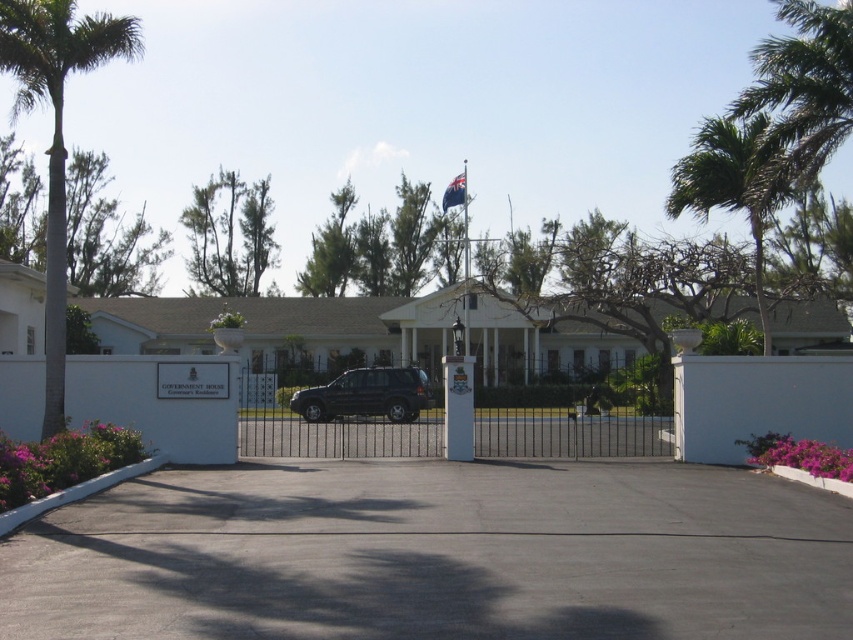
Question: Which object is farther from the camera taking this photo?

Choices:
 (A) blue fabric flag at upper center
 (B) black wrought iron gate at center
 (C) shiny black suv at center

Answer: (A)

Question: Which point is farther to the camera?

Choices:
 (A) (51, 160)
 (B) (424, 406)

Answer: (B)

Question: Which point is farther to the camera?

Choices:
 (A) (132, 45)
 (B) (300, 454)

Answer: (B)

Question: Does black asphalt driveway at center have a smaller size compared to black wrought iron gate at center?

Choices:
 (A) no
 (B) yes

Answer: (B)

Question: Does black wrought iron gate at center appear over green leafy palm tree at upper right?

Choices:
 (A) yes
 (B) no

Answer: (B)

Question: Is shiny black suv at center positioned before metallic flag pole at center?

Choices:
 (A) no
 (B) yes

Answer: (B)